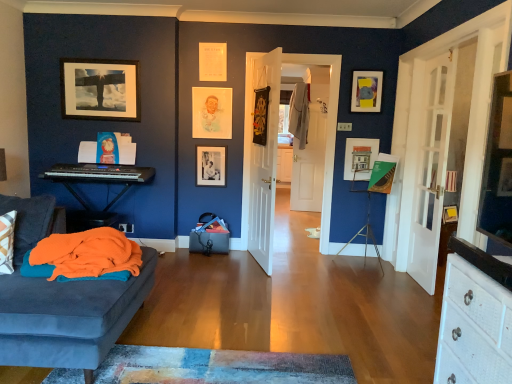
Question: Considering the positions of white glass door at right, the 1th door from the right, and black matte picture frame at center, which ranks as the fourth picture frame in right-to-left order, in the image, is white glass door at right, the 1th door from the right, wider or thinner than black matte picture frame at center, which ranks as the fourth picture frame in right-to-left order,?

Choices:
 (A) wide
 (B) thin

Answer: (A)

Question: From a real-world perspective, is white glass door at right, the 1th door from the right, physically located above or below black matte picture frame at center, which ranks as the fourth picture frame in right-to-left order?

Choices:
 (A) below
 (B) above

Answer: (B)

Question: Which object is the closest to the matte paper portrait at upper center, the 3th picture frame in the right-to-left sequence?

Choices:
 (A) matte black keyboard at left
 (B) matte black picture frame at upper left, which is the 5th picture frame in right-to-left order
 (C) black matte picture frame at center, positioned as the second picture frame in left-to-right order
 (D) matte yellow and gray picture frame at upper right, marked as the fifth picture frame in a left-to-right arrangement
 (E) matte white picture frame at center, which appears as the 2th picture frame when viewed from the right

Answer: (C)

Question: Which object is positioned closest to the black matte picture frame at center, which ranks as the fourth picture frame in right-to-left order?

Choices:
 (A) matte paper portrait at upper center, the third picture frame positioned from the left
 (B) matte black keyboard at left
 (C) black plastic keyboard at left
 (D) white glass door at right, placed as the 2th door when sorted from left to right
 (E) white wooden door at center, the second door from the right

Answer: (A)